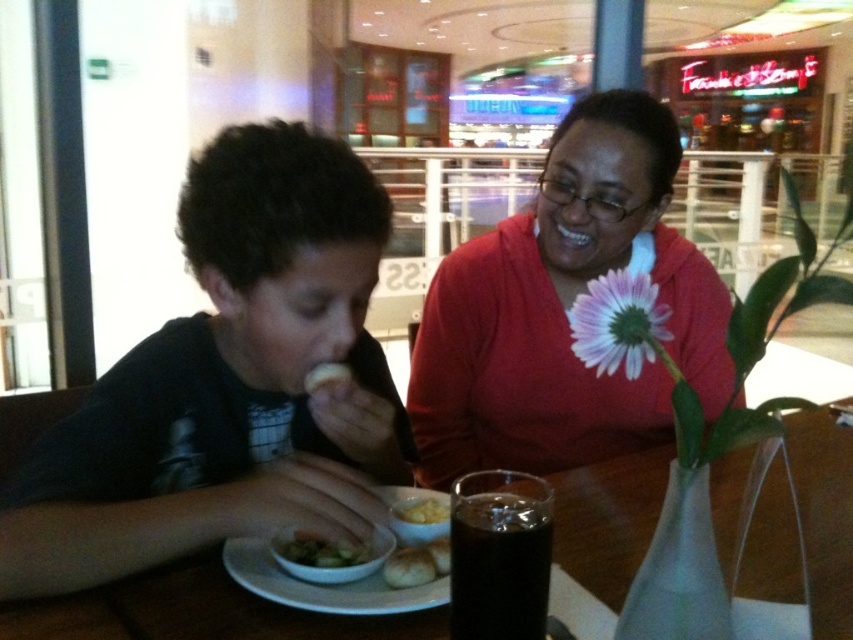
Describe the element at coordinates (229, 381) in the screenshot. I see `matte black shirt at left` at that location.

Which is behind, point (309, 198) or point (643, 394)?

Positioned behind is point (643, 394).

At what (x,y) coordinates should I click in order to perform the action: click on matte black shirt at left. Please return your answer as a coordinate pair (x, y). The width and height of the screenshot is (853, 640). Looking at the image, I should click on (229, 381).

Who is positioned more to the right, wooden table at center or dark glass cup at center?

wooden table at center

Can you confirm if wooden table at center is wider than dark glass cup at center?

Correct, the width of wooden table at center exceeds that of dark glass cup at center.

Who is more forward, [137,582] or [462,612]?

Point [462,612]

The width and height of the screenshot is (853, 640). What are the coordinates of `wooden table at center` in the screenshot? It's located at (196, 612).

Between wooden table at center and white matte plate at lower center, which one has less height?

With less height is white matte plate at lower center.

Is wooden table at center bigger than white matte plate at lower center?

Indeed, wooden table at center has a larger size compared to white matte plate at lower center.

Is point (260, 620) positioned behind point (395, 497)?

No, it is not.

At what (x,y) coordinates should I click in order to perform the action: click on wooden table at center. Please return your answer as a coordinate pair (x, y). Looking at the image, I should click on (196, 612).